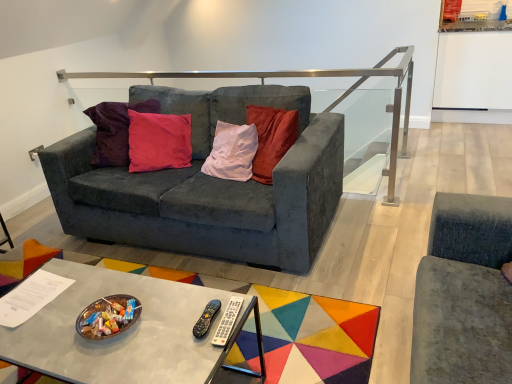
The height and width of the screenshot is (384, 512). Find the location of `free location in front of silver plastic remote at center, arranged as the 1th remote when viewed from the right`. free location in front of silver plastic remote at center, arranged as the 1th remote when viewed from the right is located at coordinates (197, 357).